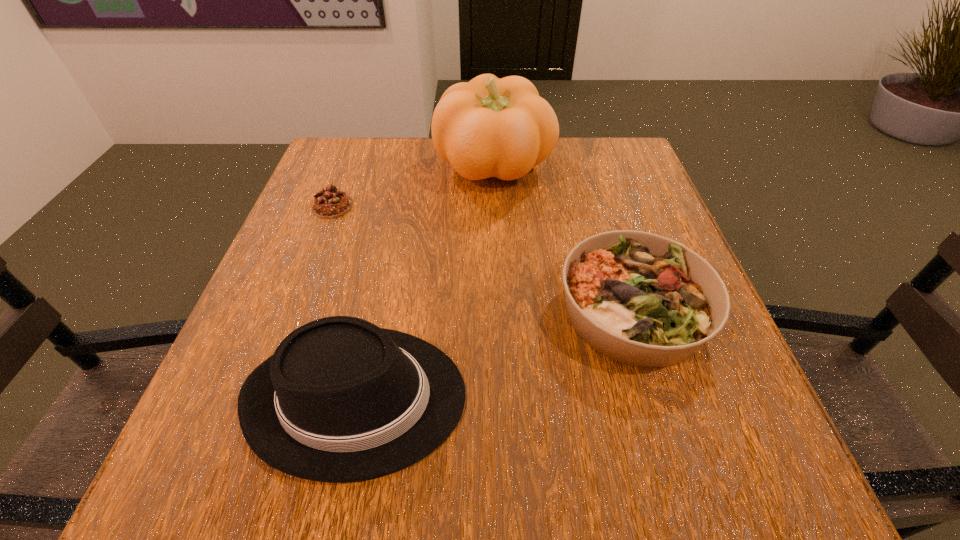
The image size is (960, 540). Find the location of `fedora positioned at the left edge`. fedora positioned at the left edge is located at coordinates (341, 400).

At what (x,y) coordinates should I click in order to perform the action: click on chocolate cake located at the left edge. Please return your answer as a coordinate pair (x, y). The height and width of the screenshot is (540, 960). Looking at the image, I should click on (330, 203).

Where is `object that is at the right edge`? object that is at the right edge is located at coordinates (642, 299).

The height and width of the screenshot is (540, 960). I want to click on object at the near left corner, so click(341, 400).

In the image, there is a desktop. Identify the location of free space at the far edge. This screenshot has height=540, width=960. (426, 141).

Image resolution: width=960 pixels, height=540 pixels. I want to click on vacant space at the near edge of the desktop, so click(512, 460).

In the image, there is a desktop. Identify the location of vacant space at the left edge. Image resolution: width=960 pixels, height=540 pixels. (293, 229).

The image size is (960, 540). Identify the location of free location at the right edge. (634, 220).

You are a GUI agent. You are given a task and a screenshot of the screen. Output one action in this format:
    pyautogui.click(x=<x>, y=<y>)
    Task: Click on the vacant space at the far right corner
    The width and height of the screenshot is (960, 540).
    Given the screenshot: What is the action you would take?
    click(x=619, y=180)

This screenshot has width=960, height=540. What are the coordinates of `free region at the near right corner` in the screenshot? It's located at (659, 453).